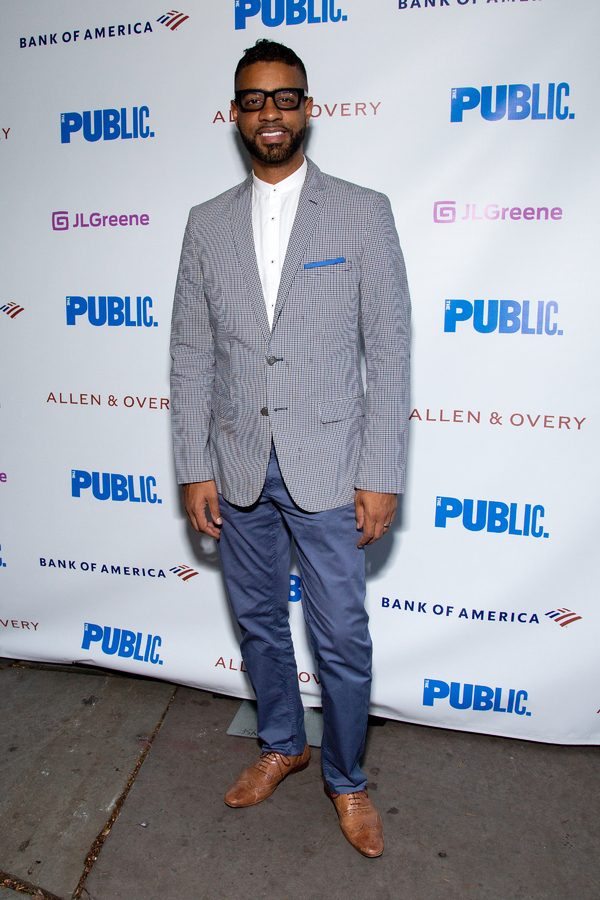
Find the location of a particular element. white wall is located at coordinates (66, 77).